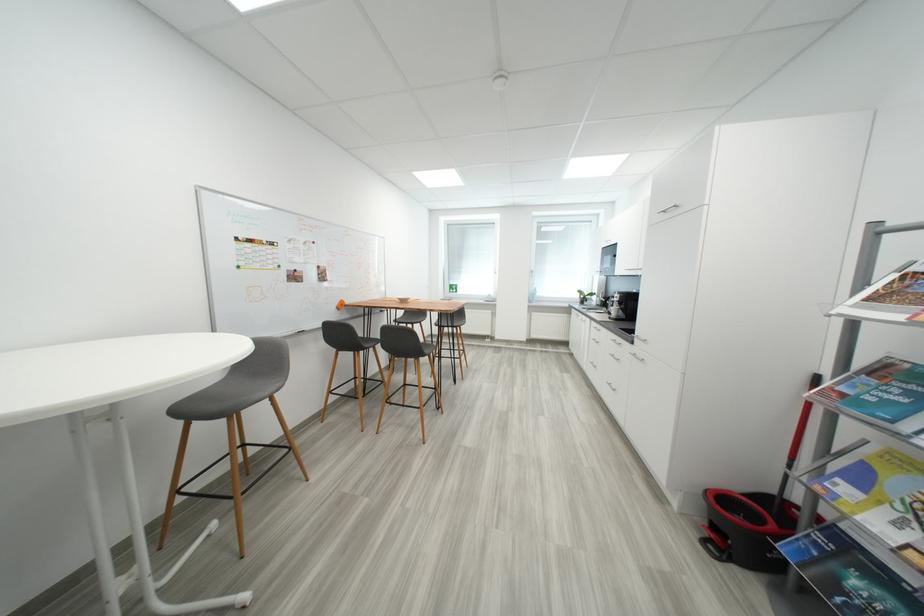
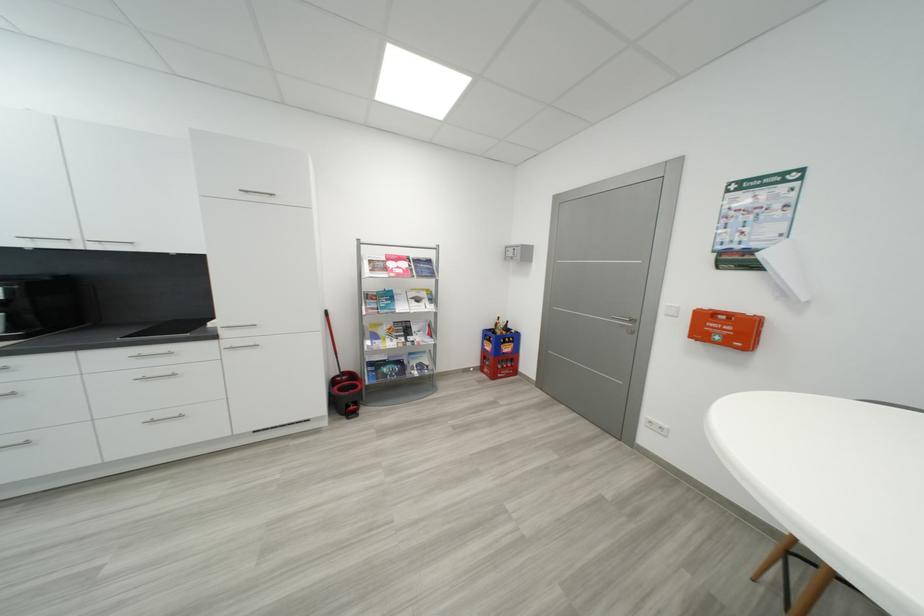
Where in the second image is the point corresponding to pixel 650 339 from the first image?

(256, 325)